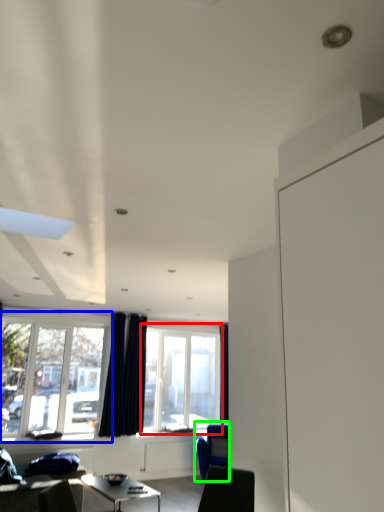
Question: Which object is the farthest from window (highlighted by a red box)? Choose among these: window (highlighted by a blue box) or armchair (highlighted by a green box).

Choices:
 (A) window
 (B) armchair

Answer: (A)